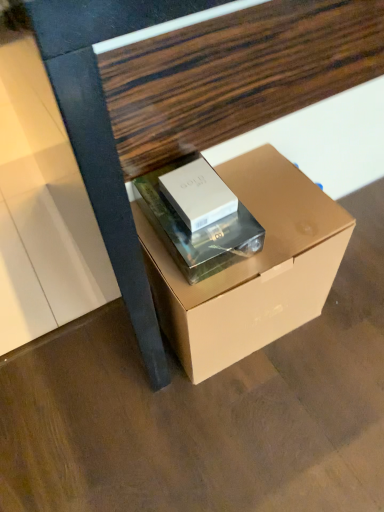
Question: From the image's perspective, is matte cardboard box at center below silver metallic box at center, which is the second box from right to left?

Choices:
 (A) yes
 (B) no

Answer: (B)

Question: Does matte cardboard box at center have a lesser width compared to silver metallic box at center, which is the second box from right to left?

Choices:
 (A) no
 (B) yes

Answer: (A)

Question: Is there a large distance between matte cardboard box at center and silver metallic box at center, acting as the first box starting from the left?

Choices:
 (A) no
 (B) yes

Answer: (A)

Question: Does matte cardboard box at center appear on the left side of silver metallic box at center, acting as the first box starting from the left?

Choices:
 (A) yes
 (B) no

Answer: (B)

Question: Is matte cardboard box at center at the right side of silver metallic box at center, acting as the first box starting from the left?

Choices:
 (A) yes
 (B) no

Answer: (A)

Question: Is matte cardboard box at center touching silver metallic box at center, acting as the first box starting from the left?

Choices:
 (A) no
 (B) yes

Answer: (A)

Question: Is silver metallic box at center, acting as the first box starting from the left, to the right of matte cardboard box at center from the viewer's perspective?

Choices:
 (A) yes
 (B) no

Answer: (B)

Question: Is silver metallic box at center, acting as the first box starting from the left, further to camera compared to matte cardboard box at center?

Choices:
 (A) yes
 (B) no

Answer: (A)

Question: Are silver metallic box at center, acting as the first box starting from the left, and matte cardboard box at center far apart?

Choices:
 (A) yes
 (B) no

Answer: (B)

Question: Is silver metallic box at center, acting as the first box starting from the left, shorter than matte cardboard box at center?

Choices:
 (A) yes
 (B) no

Answer: (A)

Question: Is silver metallic box at center, which is the second box from right to left, not inside matte cardboard box at center?

Choices:
 (A) yes
 (B) no

Answer: (B)

Question: Is the position of silver metallic box at center, acting as the first box starting from the left, less distant than that of matte cardboard box at center?

Choices:
 (A) yes
 (B) no

Answer: (B)

Question: Can you confirm if matte cardboard box at center, which appears as the 2th box when viewed from the left, is shorter than silver metallic box at center, acting as the first box starting from the left?

Choices:
 (A) no
 (B) yes

Answer: (A)